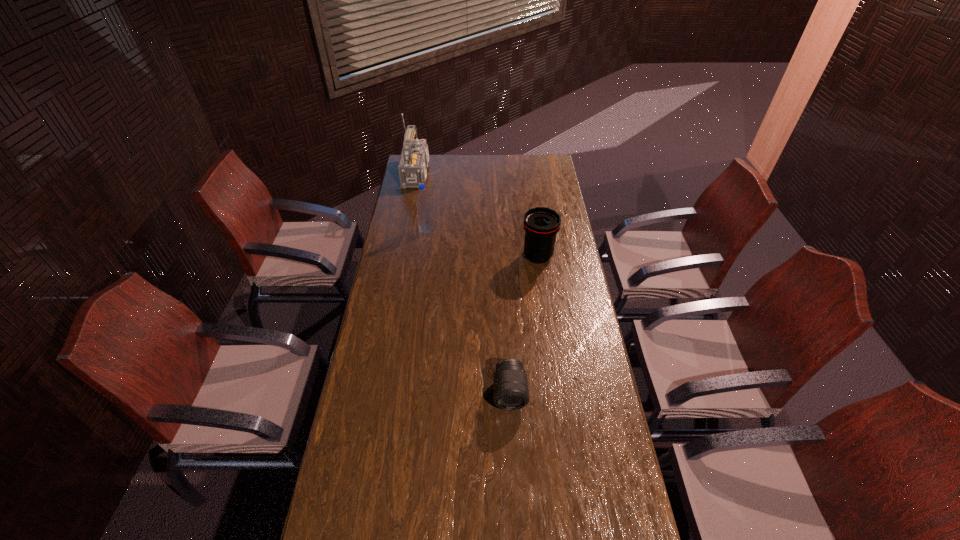
The width and height of the screenshot is (960, 540). What are the coordinates of `the farthest object` in the screenshot? It's located at (414, 159).

You are a GUI agent. You are given a task and a screenshot of the screen. Output one action in this format:
    pyautogui.click(x=<x>, y=<y>)
    Task: Click on the tallest object
    Image resolution: width=960 pixels, height=540 pixels.
    Given the screenshot: What is the action you would take?
    pyautogui.click(x=414, y=159)

At what (x,y) coordinates should I click in order to perform the action: click on the third nearest object. Please return your answer as a coordinate pair (x, y). The width and height of the screenshot is (960, 540). Looking at the image, I should click on (424, 212).

You are a GUI agent. You are given a task and a screenshot of the screen. Output one action in this format:
    pyautogui.click(x=<x>, y=<y>)
    Task: Click on the rightmost object
    This screenshot has width=960, height=540.
    Given the screenshot: What is the action you would take?
    pyautogui.click(x=541, y=224)

Find the location of a particular element. The width and height of the screenshot is (960, 540). the farther telephoto lens is located at coordinates (541, 224).

Image resolution: width=960 pixels, height=540 pixels. What are the coordinates of `the nearest object` in the screenshot? It's located at (510, 385).

The width and height of the screenshot is (960, 540). In order to click on the third object from left to right in this screenshot , I will do `click(510, 385)`.

You are a GUI agent. You are given a task and a screenshot of the screen. Output one action in this format:
    pyautogui.click(x=<x>, y=<y>)
    Task: Click on the vacant space situated on the front-facing side of the farthest object
    This screenshot has width=960, height=540.
    Given the screenshot: What is the action you would take?
    pyautogui.click(x=495, y=174)

Find the location of `vacant space located on the right of the second farthest object`. vacant space located on the right of the second farthest object is located at coordinates (508, 229).

This screenshot has width=960, height=540. I want to click on vacant area situated 0.150m on the front of the farther telephoto lens, so click(x=543, y=293).